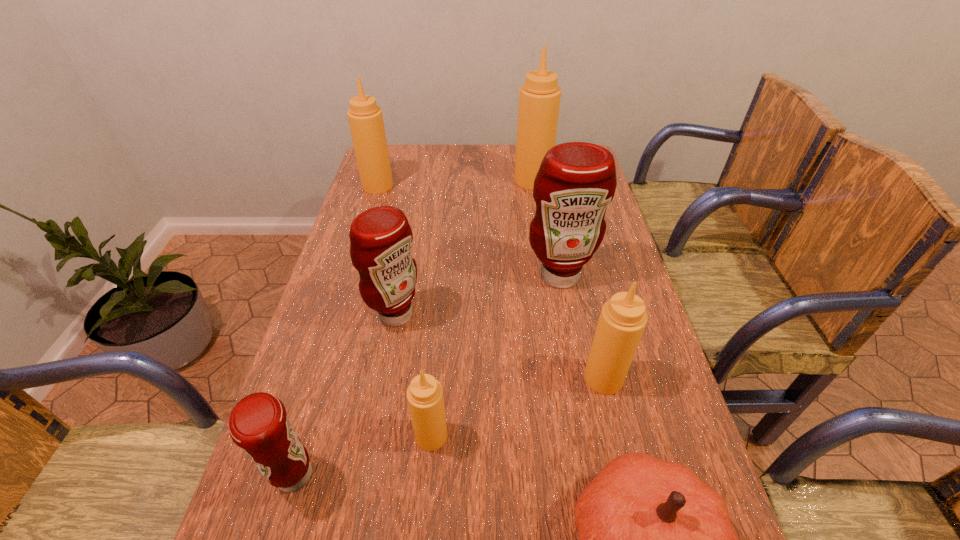
Locate an element on the screen. the tallest object is located at coordinates (539, 99).

You are a GUI agent. You are given a task and a screenshot of the screen. Output one action in this format:
    pyautogui.click(x=<x>, y=<y>)
    Task: Click on the tallest condiment
    
    Given the screenshot: What is the action you would take?
    pyautogui.click(x=539, y=99)

Image resolution: width=960 pixels, height=540 pixels. In order to click on the leftmost tan condiment in this screenshot , I will do `click(365, 118)`.

You are a GUI agent. You are given a task and a screenshot of the screen. Output one action in this format:
    pyautogui.click(x=<x>, y=<y>)
    Task: Click on the fifth nearest condiment
    The image size is (960, 540).
    Given the screenshot: What is the action you would take?
    pyautogui.click(x=576, y=181)

Identify the location of the farthest red condiment. This screenshot has width=960, height=540. (576, 181).

Where is `the fourth nearest condiment`? the fourth nearest condiment is located at coordinates (381, 239).

Find the location of a particular element. Image resolution: width=960 pixels, height=540 pixels. the second nearest red condiment is located at coordinates (381, 239).

Where is `the second smallest tan condiment`? the second smallest tan condiment is located at coordinates (623, 318).

The width and height of the screenshot is (960, 540). In order to click on the second nearest tan condiment in this screenshot , I will do `click(623, 318)`.

This screenshot has height=540, width=960. Identify the location of the smallest tan condiment. (425, 398).